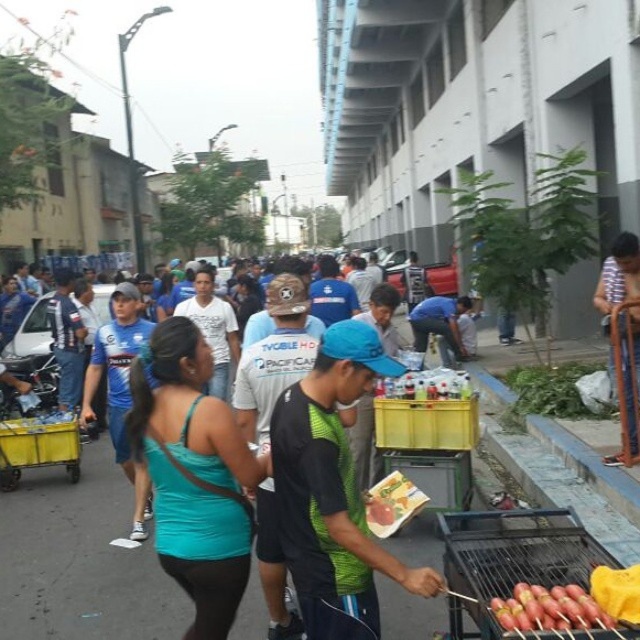
You are standing at the center of the street and want to reach the metallic grill at lower right. According to the 2D coordinates provided, in which direction should you move from your current position to reach it?

The metallic grill at lower right is located at coordinates 0.875 on the x axis and 0.800 on the y axis. Since you are at the center, which is at 0.5 on both axes, you should move towards the right and upward to reach it.

You are a participant in the event and want to grab some food. You are standing in the middle of the street. Which object, the metallic grill at lower right or the yellow plastic cart at lower left, is nearer to you?

The metallic grill at lower right is closer to the viewer than the yellow plastic cart at lower left, so the metallic grill at lower right is nearer to you.